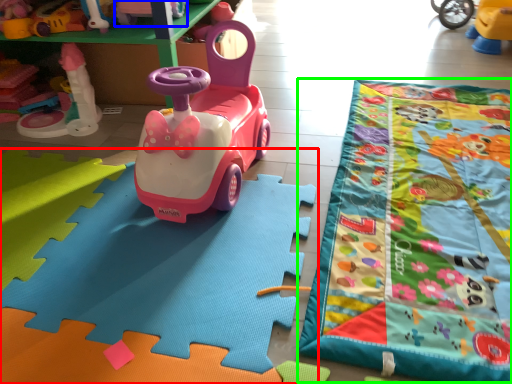
Question: Estimate the real-world distances between objects in this image. Which object is closer to toy (highlighted by a red box), toy (highlighted by a blue box) or blanket (highlighted by a green box)?

Choices:
 (A) toy
 (B) blanket

Answer: (B)